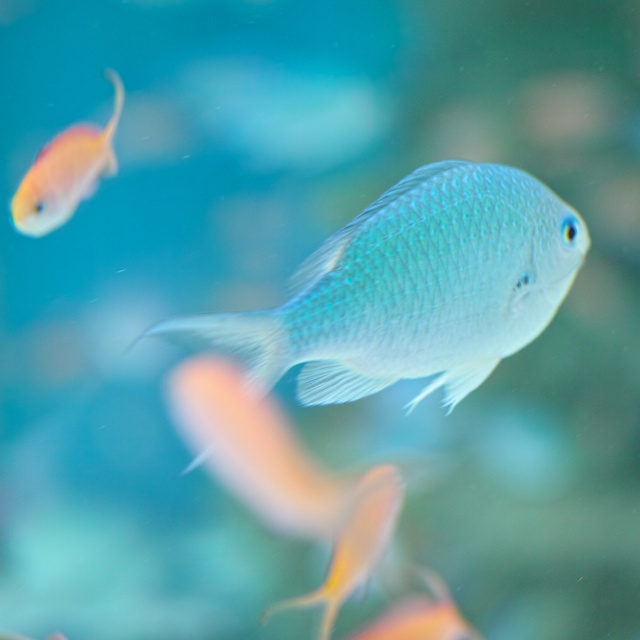
Question: Does translucent pinkish-yellow fish at upper left appear on the left side of translucent yellowish fish at center?

Choices:
 (A) yes
 (B) no

Answer: (A)

Question: Which object is farther from the camera taking this photo?

Choices:
 (A) translucent yellowish fish at center
 (B) shiny blue fish at center

Answer: (A)

Question: Estimate the real-world distances between objects in this image. Which object is closer to the shiny blue fish at center?

Choices:
 (A) translucent pinkish-yellow fish at upper left
 (B) translucent yellowish fish at center

Answer: (B)

Question: Is translucent pinkish-yellow fish at upper left below translucent yellowish fish at center?

Choices:
 (A) yes
 (B) no

Answer: (B)

Question: Estimate the real-world distances between objects in this image. Which object is farther from the translucent yellowish fish at center?

Choices:
 (A) shiny blue fish at center
 (B) translucent pinkish-yellow fish at upper left

Answer: (B)

Question: Is the position of shiny blue fish at center more distant than that of translucent pinkish-yellow fish at upper left?

Choices:
 (A) no
 (B) yes

Answer: (A)